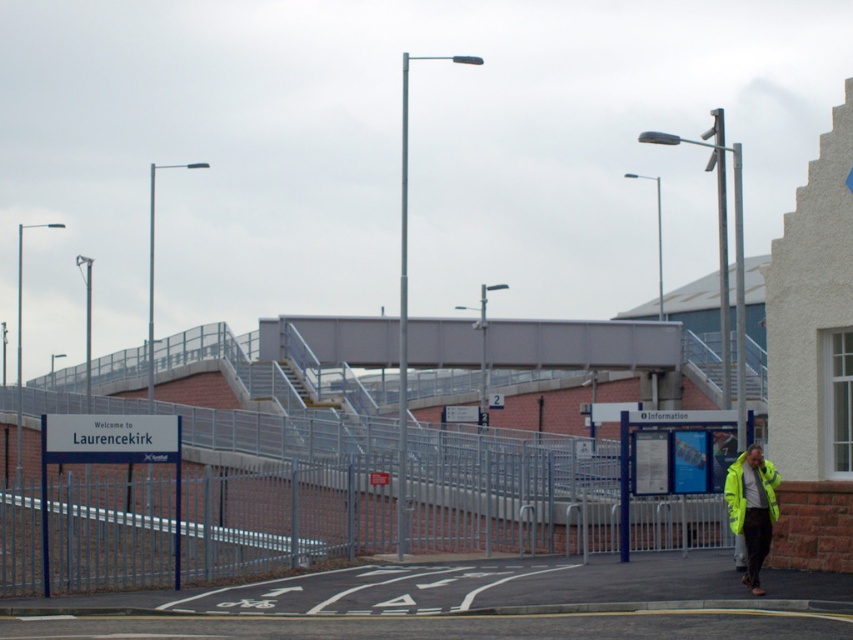
Is metallic silver fence at center above high visibility yellow jacket at lower right?

Actually, metallic silver fence at center is below high visibility yellow jacket at lower right.

At what (x,y) coordinates should I click in order to perform the action: click on metallic silver fence at center. Please return your answer as a coordinate pair (x, y). The width and height of the screenshot is (853, 640). Looking at the image, I should click on (202, 502).